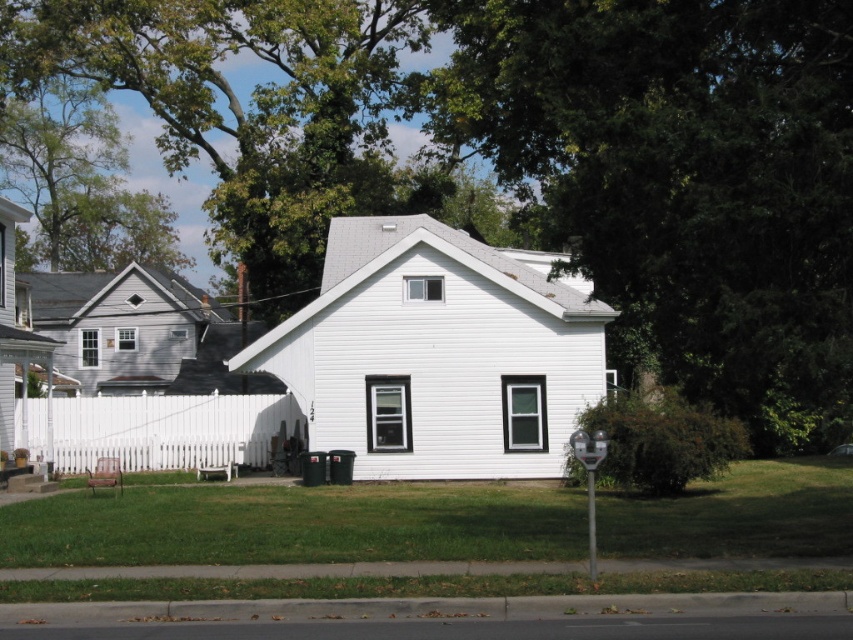
Between green leafy tree at upper center and green grass at lower center, which one is positioned lower?

green grass at lower center is lower down.

In the scene shown: Is green leafy tree at upper center smaller than green grass at lower center?

Actually, green leafy tree at upper center might be larger than green grass at lower center.

The height and width of the screenshot is (640, 853). Describe the element at coordinates (538, 154) in the screenshot. I see `green leafy tree at upper center` at that location.

Where is `green leafy tree at upper center`? This screenshot has height=640, width=853. green leafy tree at upper center is located at coordinates (538, 154).

Does point (573, 532) come in front of point (99, 452)?

Yes, point (573, 532) is in front of point (99, 452).

Based on the photo, does green grass at lower center have a greater height compared to white picket fence at lower left?

No.

You are a GUI agent. You are given a task and a screenshot of the screen. Output one action in this format:
    pyautogui.click(x=<x>, y=<y>)
    Task: Click on the green grass at lower center
    This screenshot has height=640, width=853.
    Given the screenshot: What is the action you would take?
    pyautogui.click(x=294, y=524)

Does point (799, 161) come closer to viewer compared to point (170, 467)?

Yes, point (799, 161) is in front of point (170, 467).

Can you confirm if green leafy tree at upper center is positioned above white picket fence at lower left?

Correct, green leafy tree at upper center is located above white picket fence at lower left.

Is point (381, 42) in front of point (59, 449)?

That is False.

Locate an element on the screen. green leafy tree at upper center is located at coordinates (538, 154).